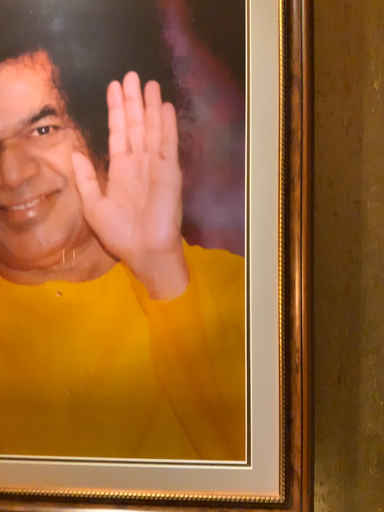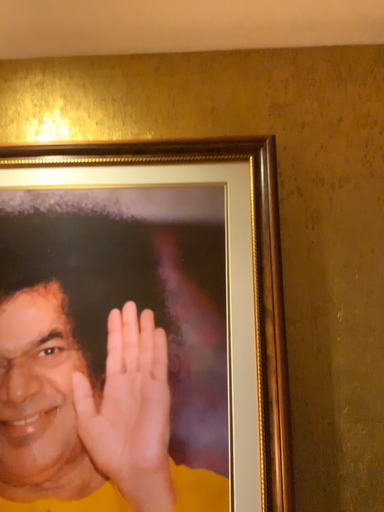
Question: Which way did the camera rotate in the video?

Choices:
 (A) rotated upward
 (B) rotated downward

Answer: (A)